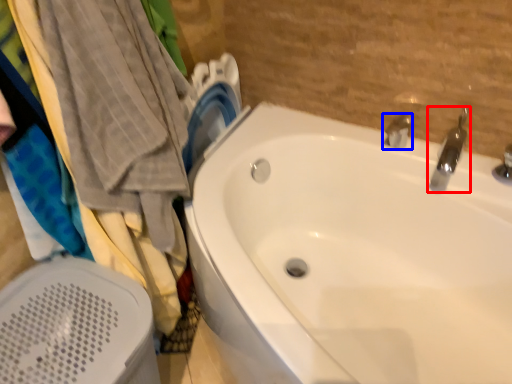
Question: Which of the following is the closest to the observer, tap (highlighted by a red box) or tap (highlighted by a blue box)?

Choices:
 (A) tap
 (B) tap

Answer: (A)